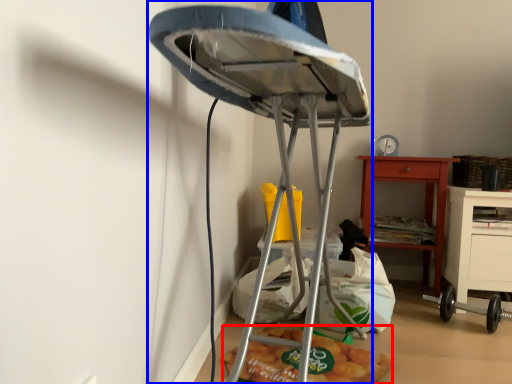
Question: Among these objects, which one is farthest to the camera, food (highlighted by a red box) or furniture (highlighted by a blue box)?

Choices:
 (A) food
 (B) furniture

Answer: (A)